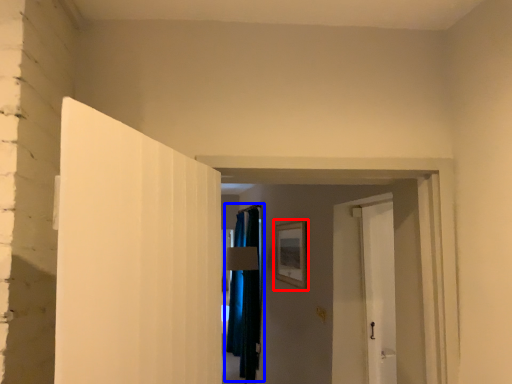
Question: Which object is closer to the camera taking this photo, picture frame (highlighted by a red box) or curtain (highlighted by a blue box)?

Choices:
 (A) picture frame
 (B) curtain

Answer: (A)